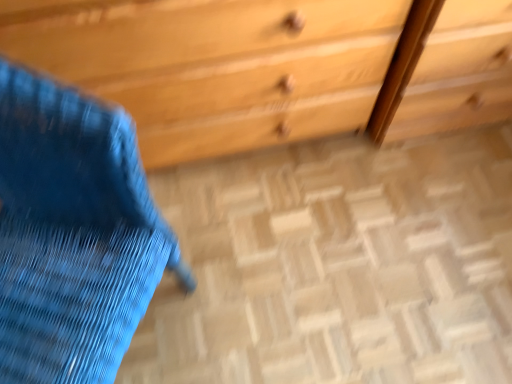
Where is `free spot above wooden floor at center (from a real-world perspective)`? The height and width of the screenshot is (384, 512). free spot above wooden floor at center (from a real-world perspective) is located at coordinates (343, 255).